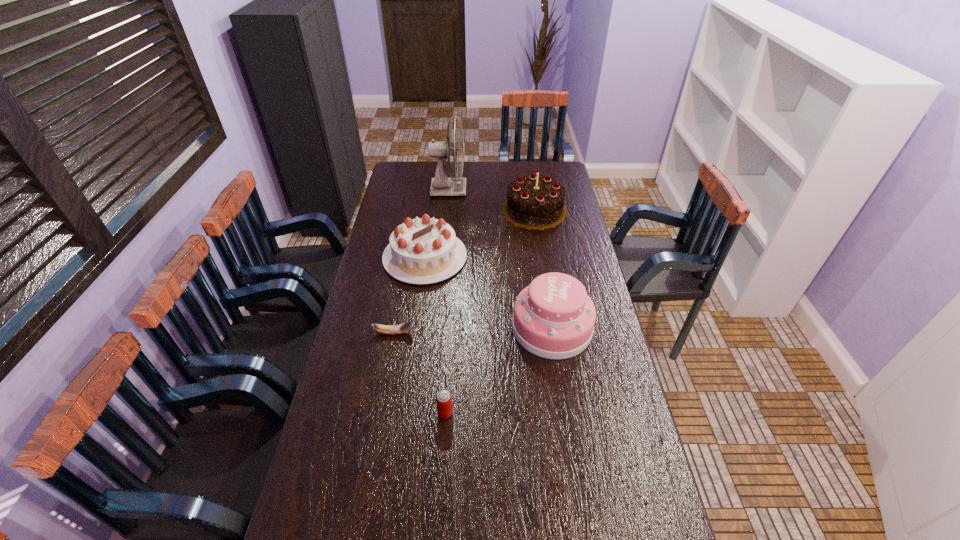
This screenshot has height=540, width=960. Identify the location of birthday cake that is the second closest to the second farthest birthday cake. (553, 318).

The width and height of the screenshot is (960, 540). I want to click on birthday cake object that ranks as the closest to the farthest birthday cake, so click(421, 251).

What are the coordinates of `vacant region that satisfies the following two spatial constraints: 1. at the stem of the banana; 2. on the right side of the nearest object` in the screenshot? It's located at (379, 413).

Locate an element on the screen. This screenshot has height=540, width=960. vacant space that satisfies the following two spatial constraints: 1. on the back side of the beer can; 2. on the front-facing side of the fan is located at coordinates (460, 190).

This screenshot has width=960, height=540. I want to click on vacant space that satisfies the following two spatial constraints: 1. on the back side of the farthest birthday cake; 2. on the right side of the third shortest object, so click(x=431, y=210).

At what (x,y) coordinates should I click in order to perform the action: click on vacant space that satisfies the following two spatial constraints: 1. on the back side of the nearest birthday cake; 2. on the left side of the farthest birthday cake. Please return your answer as a coordinate pair (x, y). Looking at the image, I should click on point(534,210).